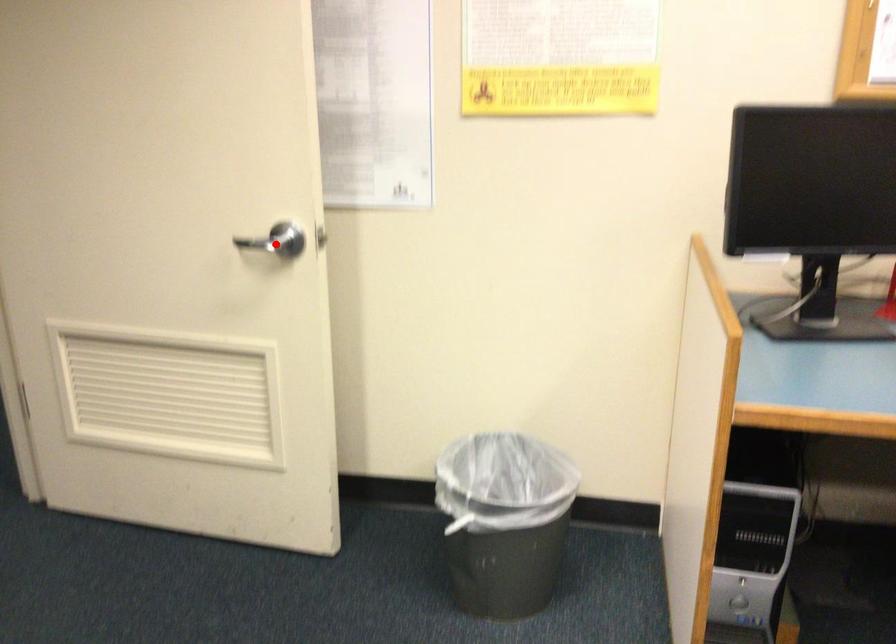
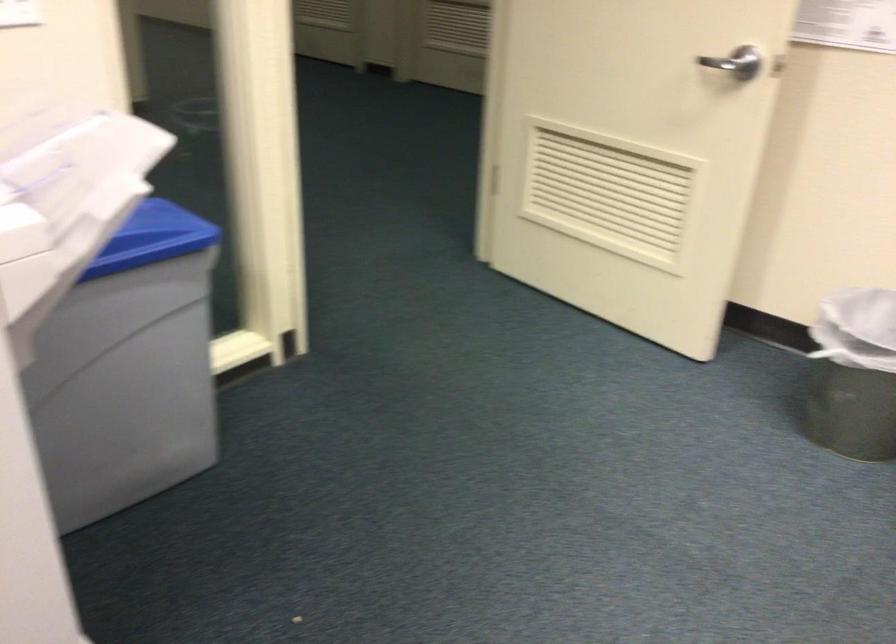
Locate, in the second image, the point that corresponds to the highlighted location in the first image.

(736, 62)